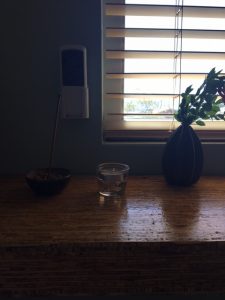
Where is `white blinds`? The image size is (225, 300). white blinds is located at coordinates (123, 95).